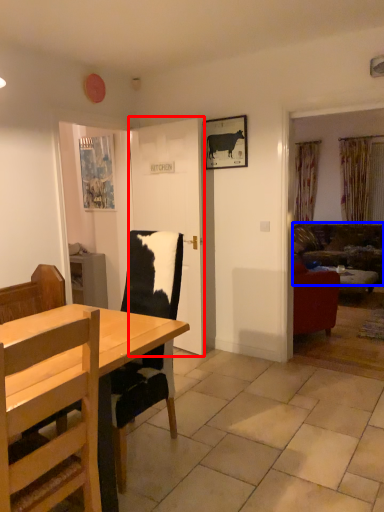
Question: Which object appears closest to the camera in this image, door (highlighted by a red box) or studio couch (highlighted by a blue box)?

Choices:
 (A) door
 (B) studio couch

Answer: (A)